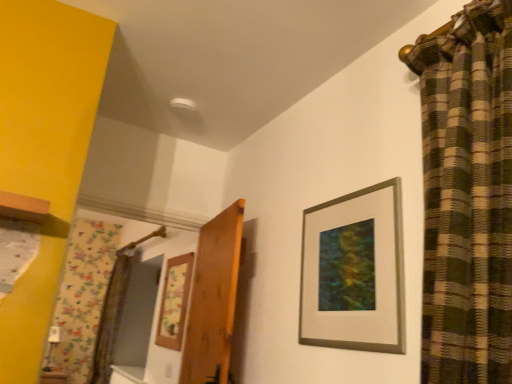
Question: From a real-world perspective, is wooden picture frame at center, the second picture frame viewed from the top, located beneath silver/metallic picture frame at upper right, the first picture frame viewed from the front?

Choices:
 (A) no
 (B) yes

Answer: (B)

Question: Is wooden picture frame at center, placed as the first picture frame when sorted from left to right, to the right of silver/metallic picture frame at upper right, the second picture frame in the bottom-to-top sequence, from the viewer's perspective?

Choices:
 (A) yes
 (B) no

Answer: (B)

Question: Is the depth of wooden picture frame at center, which is counted as the 1th picture frame, starting from the bottom, greater than that of silver/metallic picture frame at upper right, which is counted as the second picture frame, starting from the left?

Choices:
 (A) no
 (B) yes

Answer: (B)

Question: Is wooden picture frame at center, placed as the first picture frame when sorted from left to right, taller than silver/metallic picture frame at upper right, which is the second picture frame from back to front?

Choices:
 (A) no
 (B) yes

Answer: (B)

Question: Does wooden picture frame at center, placed as the first picture frame when sorted from left to right, lie in front of silver/metallic picture frame at upper right, which is counted as the second picture frame, starting from the left?

Choices:
 (A) no
 (B) yes

Answer: (A)

Question: From a real-world perspective, relative to silver/metallic picture frame at upper right, positioned as the 1th picture frame in right-to-left order, is wooden door at center vertically above or below?

Choices:
 (A) above
 (B) below

Answer: (B)

Question: Would you say wooden door at center is inside or outside silver/metallic picture frame at upper right, which is the second picture frame from back to front?

Choices:
 (A) inside
 (B) outside

Answer: (B)

Question: Considering the positions of wooden door at center and silver/metallic picture frame at upper right, placed as the 1th picture frame when sorted from top to bottom, in the image, is wooden door at center bigger or smaller than silver/metallic picture frame at upper right, placed as the 1th picture frame when sorted from top to bottom,?

Choices:
 (A) small
 (B) big

Answer: (B)

Question: Is point (215, 271) closer or farther from the camera than point (395, 324)?

Choices:
 (A) closer
 (B) farther

Answer: (B)

Question: Is wooden picture frame at center, placed as the first picture frame when sorted from left to right, in front of or behind silver/metallic picture frame at upper right, positioned as the 1th picture frame in right-to-left order, in the image?

Choices:
 (A) front
 (B) behind

Answer: (B)

Question: Is wooden picture frame at center, placed as the first picture frame when sorted from left to right, situated inside silver/metallic picture frame at upper right, the first picture frame viewed from the front, or outside?

Choices:
 (A) inside
 (B) outside

Answer: (B)

Question: Is wooden picture frame at center, the second picture frame viewed from the top, bigger or smaller than silver/metallic picture frame at upper right, which is counted as the second picture frame, starting from the left?

Choices:
 (A) big
 (B) small

Answer: (A)

Question: Would you say wooden picture frame at center, the second picture frame viewed from the top, is to the left or to the right of silver/metallic picture frame at upper right, positioned as the 1th picture frame in right-to-left order, in the picture?

Choices:
 (A) right
 (B) left

Answer: (B)

Question: From the image's perspective, is silver/metallic picture frame at upper right, the second picture frame in the bottom-to-top sequence, located above or below wooden picture frame at center, the second picture frame viewed from the top?

Choices:
 (A) below
 (B) above

Answer: (B)

Question: Is point (387, 296) positioned closer to the camera than point (176, 286)?

Choices:
 (A) closer
 (B) farther

Answer: (A)